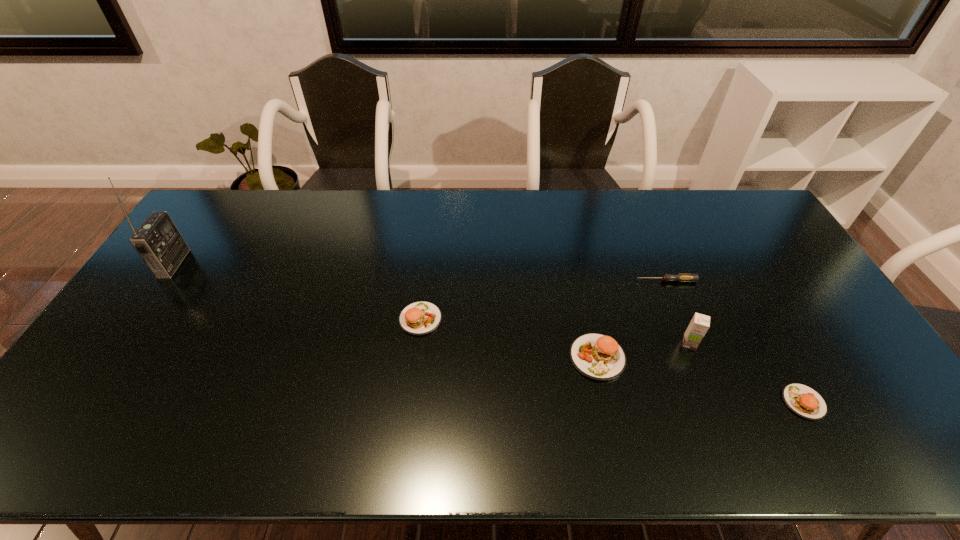
Where is `the second object from left to right`? The width and height of the screenshot is (960, 540). the second object from left to right is located at coordinates (419, 318).

The width and height of the screenshot is (960, 540). I want to click on the third shortest object, so click(x=419, y=318).

You are a GUI agent. You are given a task and a screenshot of the screen. Output one action in this format:
    pyautogui.click(x=<x>, y=<y>)
    Task: Click on the fourth object from right to left
    The image size is (960, 540).
    Given the screenshot: What is the action you would take?
    pyautogui.click(x=599, y=357)

Locate an element on the screen. the tallest patty is located at coordinates (599, 357).

This screenshot has width=960, height=540. Identify the location of the rightmost patty. (804, 401).

Locate an element on the screen. The height and width of the screenshot is (540, 960). the nearest patty is located at coordinates (804, 401).

Identify the location of the leftmost object. The width and height of the screenshot is (960, 540). (157, 240).

This screenshot has height=540, width=960. Identify the location of the tallest object. (157, 240).

The image size is (960, 540). I want to click on screwdriver, so click(678, 277).

Where is `chocolate milk`? The image size is (960, 540). chocolate milk is located at coordinates (699, 325).